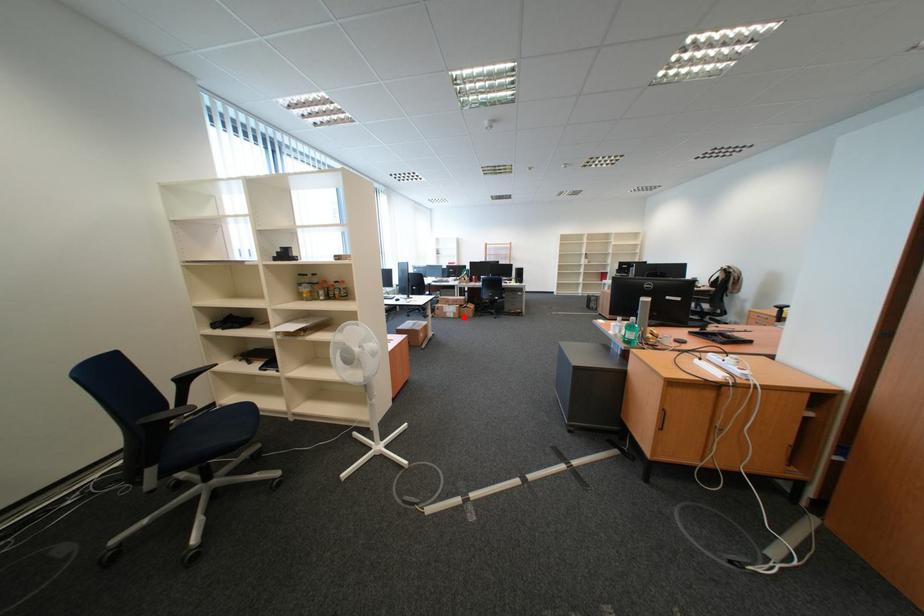
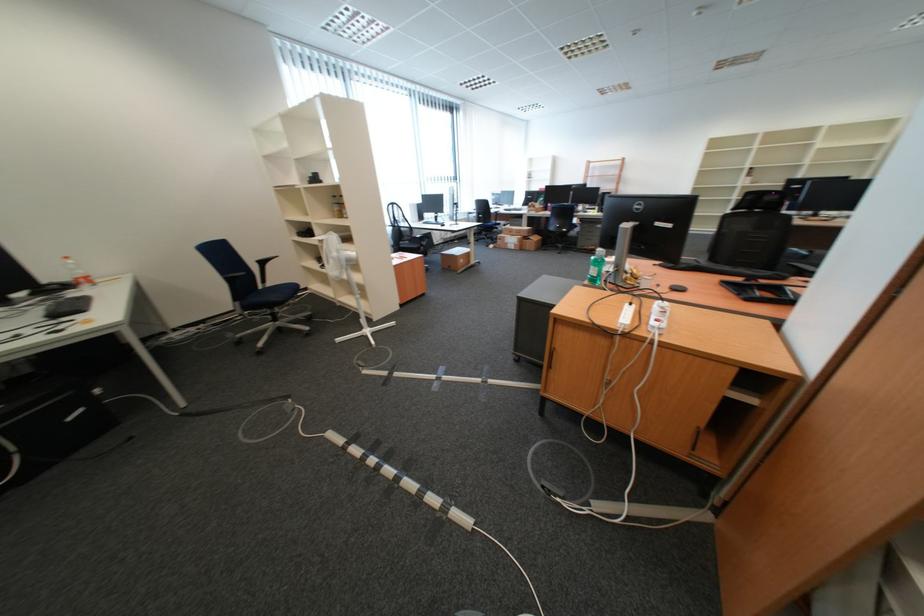
Locate, in the second image, the point that corresponds to the highlighted location in the first image.

(525, 249)